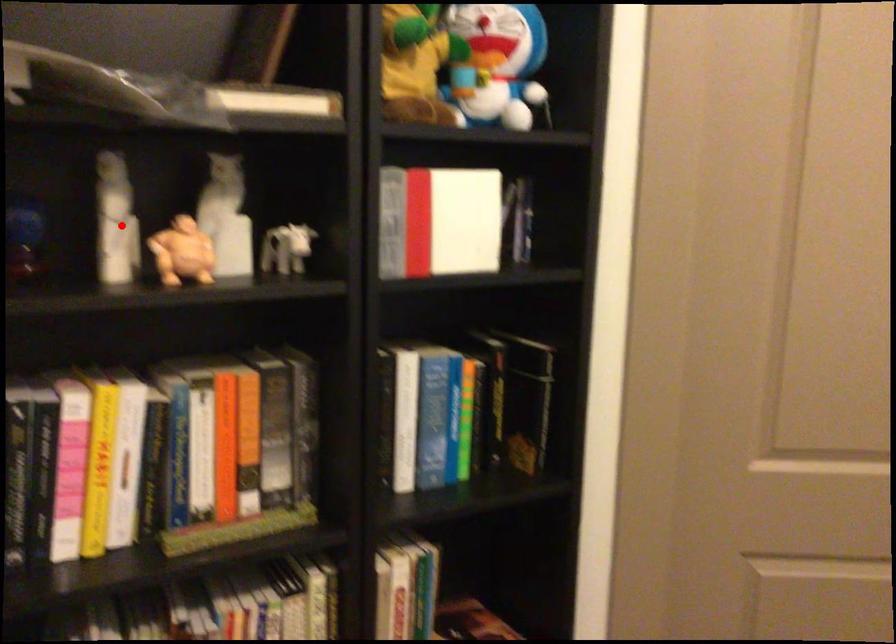
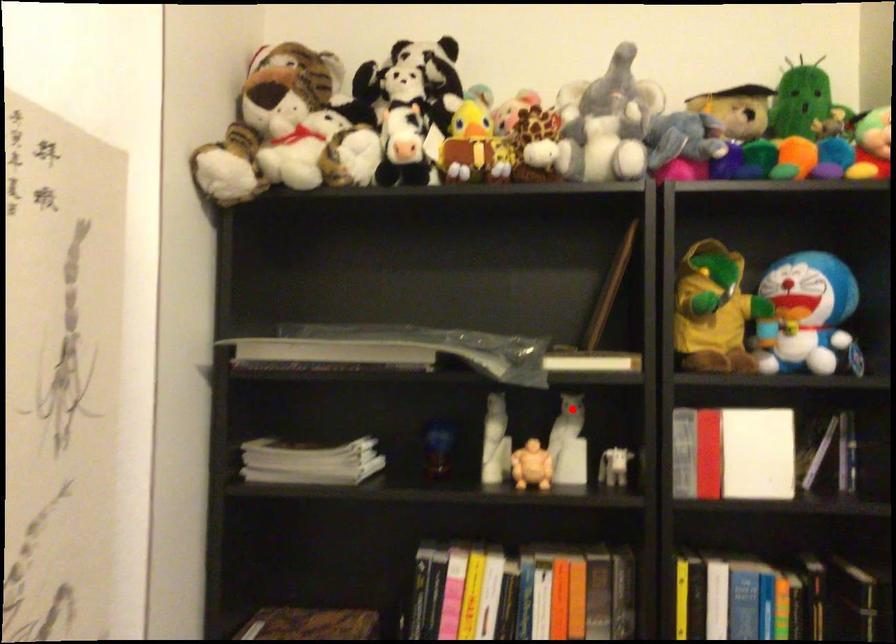
I am providing you with two images of the same scene from different viewpoints. A red point is marked on the first image and another point is marked on the second image. Is the red point in image1 aligned with the point shown in image2?

No